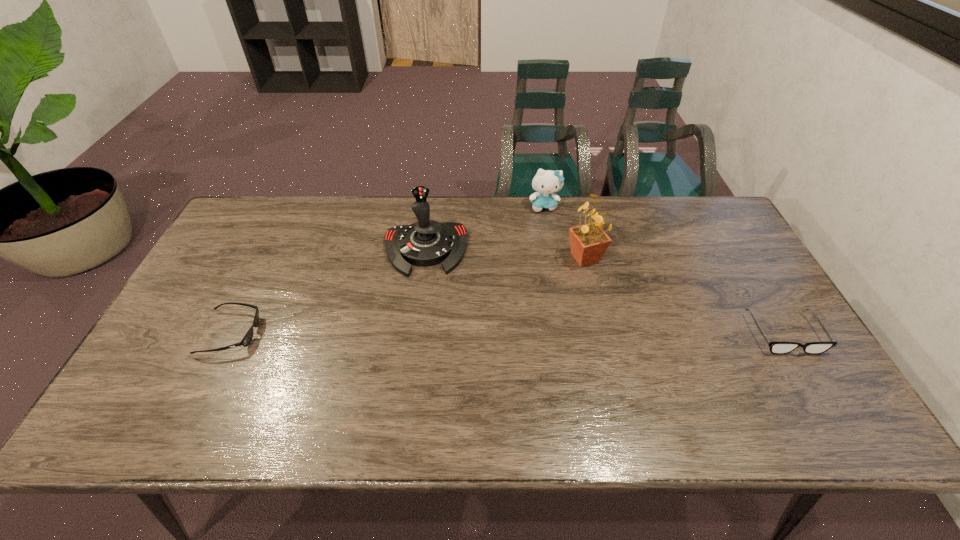
Where is `empty space between the third shortest object and the sunglasses`? This screenshot has width=960, height=540. empty space between the third shortest object and the sunglasses is located at coordinates (388, 269).

The image size is (960, 540). I want to click on empty space that is in between the third shortest object and the sunflower, so click(x=564, y=232).

Locate an element on the screen. free space that is in between the sunglasses and the sunflower is located at coordinates (408, 295).

Locate an element on the screen. unoccupied position between the sunflower and the shortest object is located at coordinates (408, 295).

Locate an element on the screen. The width and height of the screenshot is (960, 540). free space between the farthest object and the second object from left to right is located at coordinates (485, 228).

The height and width of the screenshot is (540, 960). Identify the location of free space between the farthest object and the joystick. (485, 228).

Identify the location of the fourth closest object to the sunglasses. (775, 347).

You are a GUI agent. You are given a task and a screenshot of the screen. Output one action in this format:
    pyautogui.click(x=<x>, y=<y>)
    Task: Click on the second closest object to the rightmost object
    
    Given the screenshot: What is the action you would take?
    546,182

The width and height of the screenshot is (960, 540). I want to click on free space that satisfies the following two spatial constraints: 1. on the front side of the third shortest object; 2. on the right side of the sunflower, so click(x=553, y=258).